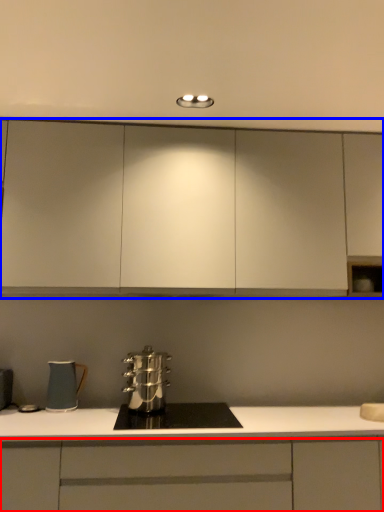
Question: Among these objects, which one is nearest to the camera, cabinetry (highlighted by a red box) or cabinetry (highlighted by a blue box)?

Choices:
 (A) cabinetry
 (B) cabinetry

Answer: (A)